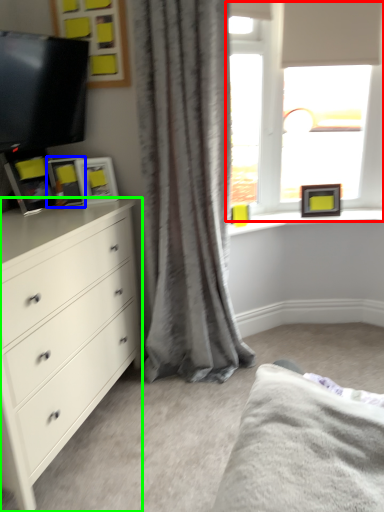
Question: Estimate the real-world distances between objects in this image. Which object is farther from window (highlighted by a red box), picture frame (highlighted by a blue box) or chest of drawers (highlighted by a green box)?

Choices:
 (A) picture frame
 (B) chest of drawers

Answer: (B)